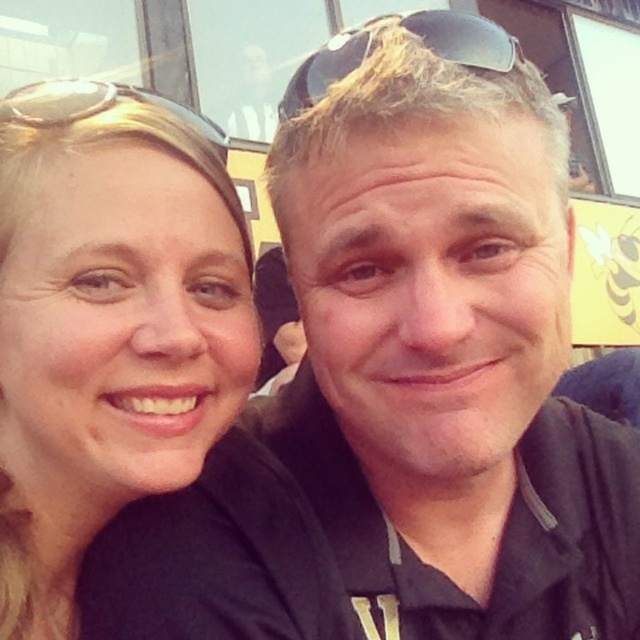
Is matte blonde hair at left thinner than sunglasses at center?

No, matte blonde hair at left is not thinner than sunglasses at center.

Find the location of a particular element. matte blonde hair at left is located at coordinates (108, 324).

At what (x,y) coordinates should I click in order to perform the action: click on matte blonde hair at left. Please return your answer as a coordinate pair (x, y). The width and height of the screenshot is (640, 640). Looking at the image, I should click on (108, 324).

Is matte blonde hair at left closer to camera compared to gold reflective sunglasses at upper left?

Yes, it is.

Which is in front, point (48, 253) or point (74, 92)?

Point (48, 253)

Identify the location of matte blonde hair at left. This screenshot has height=640, width=640. (108, 324).

Does sunglasses at center have a lesser height compared to gold reflective sunglasses at upper left?

In fact, sunglasses at center may be taller than gold reflective sunglasses at upper left.

Is point (500, 28) more distant than point (140, 92)?

Yes.

Is point (352, 28) farther from viewer compared to point (72, 88)?

That is True.

You are a GUI agent. You are given a task and a screenshot of the screen. Output one action in this format:
    pyautogui.click(x=<x>, y=<y>)
    Task: Click on the sunglasses at center
    Image resolution: width=640 pixels, height=640 pixels.
    Given the screenshot: What is the action you would take?
    pyautogui.click(x=410, y=32)